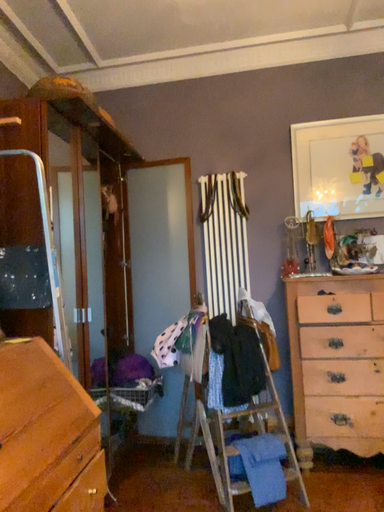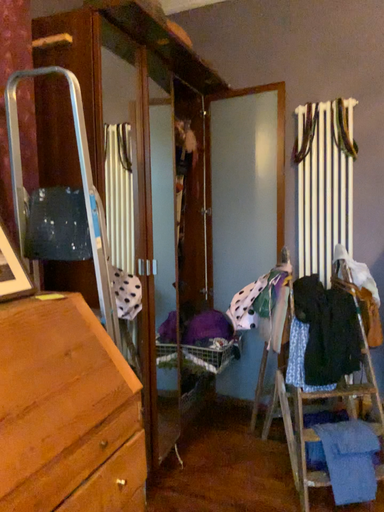
Question: Which way did the camera rotate in the video?

Choices:
 (A) rotated left
 (B) rotated right

Answer: (A)